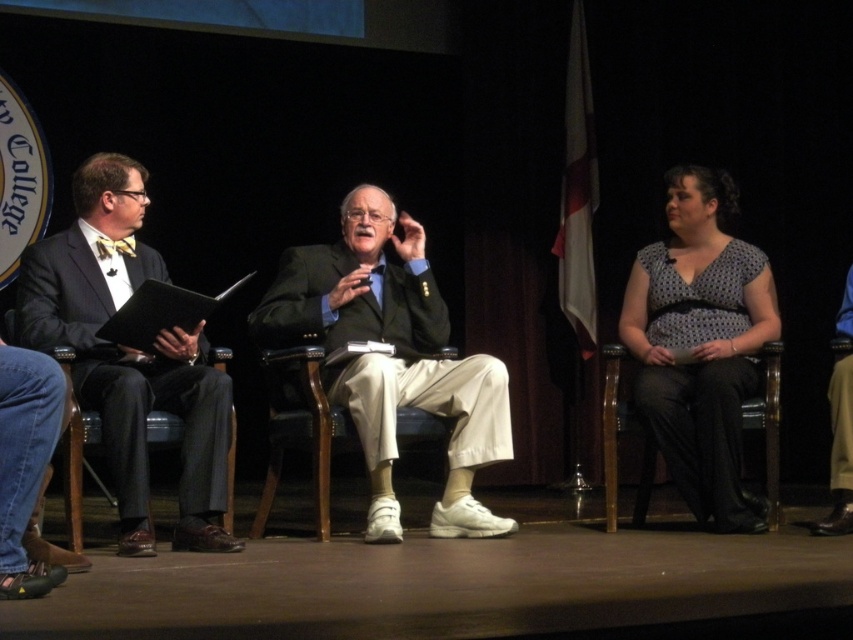
In the scene shown: Which is more to the right, matte black suit at left or black fabric chair at right?

black fabric chair at right

Can you confirm if matte black suit at left is bigger than black fabric chair at right?

Yes, matte black suit at left is bigger than black fabric chair at right.

Does point (108, 401) come in front of point (767, 438)?

Yes.

At what (x,y) coordinates should I click in order to perform the action: click on matte black suit at left. Please return your answer as a coordinate pair (x, y). Looking at the image, I should click on (129, 355).

Which is more to the right, matte black suit at left or wooden chair at center?

From the viewer's perspective, wooden chair at center appears more on the right side.

Does matte black suit at left come in front of wooden chair at center?

Yes, it is in front of wooden chair at center.

Find the location of a particular element. The width and height of the screenshot is (853, 640). matte black suit at left is located at coordinates (129, 355).

Where is `matte black suit at left`? This screenshot has height=640, width=853. matte black suit at left is located at coordinates (129, 355).

Based on the photo, does dark green suit at center have a larger size compared to black fabric chair at right?

Indeed, dark green suit at center has a larger size compared to black fabric chair at right.

Based on the photo, is dark green suit at center positioned at the back of black fabric chair at right?

That is False.

Is point (277, 333) closer to viewer compared to point (610, 428)?

Yes, it is in front of point (610, 428).

At what (x,y) coordinates should I click in order to perform the action: click on dark green suit at center. Please return your answer as a coordinate pair (x, y). The image size is (853, 640). Looking at the image, I should click on pos(392,358).